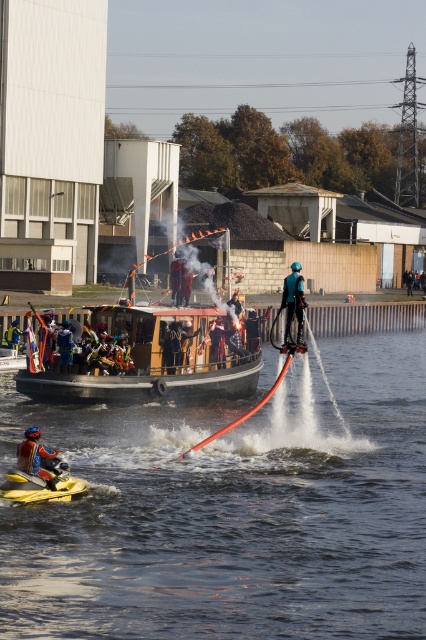
Question: Which of the following is the closest to the observer?

Choices:
 (A) (287, 284)
 (B) (172, 369)

Answer: (A)

Question: Estimate the real-world distances between objects in this image. Which object is closer to the blue fabric life jacket at lower left?

Choices:
 (A) clear water at jet ski right
 (B) black leather jacket at center
 (C) teal matte jetpack at center
 (D) red fabric person at center

Answer: (A)

Question: Is clear water at jet ski right to the right of red fabric person at center from the viewer's perspective?

Choices:
 (A) no
 (B) yes

Answer: (B)

Question: Which point is closer to the camera?

Choices:
 (A) yellow rubber boat at lower left
 (B) clear water at jet ski right

Answer: (B)

Question: Does yellow rubber boat at lower left have a smaller size compared to red fabric person at center?

Choices:
 (A) yes
 (B) no

Answer: (A)

Question: Considering the relative positions of teal matte jetpack at center and red fabric person at center in the image provided, where is teal matte jetpack at center located with respect to red fabric person at center?

Choices:
 (A) above
 (B) below

Answer: (B)